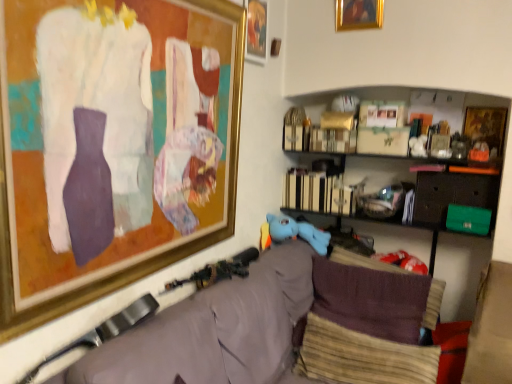
Question: Is wooden framed picture at upper right, the fourth picture frame viewed from the left, taller than matte brown cushion at lower right?

Choices:
 (A) yes
 (B) no

Answer: (B)

Question: Is wooden framed picture at upper right, the fourth picture frame viewed from the left, at the right side of matte brown cushion at lower right?

Choices:
 (A) no
 (B) yes

Answer: (B)

Question: Can you confirm if wooden framed picture at upper right, the fourth picture frame viewed from the left, is shorter than matte brown cushion at lower right?

Choices:
 (A) no
 (B) yes

Answer: (B)

Question: Is there a large distance between wooden framed picture at upper right, the first picture frame from the right, and matte brown cushion at lower right?

Choices:
 (A) no
 (B) yes

Answer: (A)

Question: Is wooden framed picture at upper right, the first picture frame from the right, to the left of matte brown cushion at lower right from the viewer's perspective?

Choices:
 (A) yes
 (B) no

Answer: (B)

Question: Does wooden framed picture at upper right, the first picture frame from the right, have a greater width compared to matte brown cushion at lower right?

Choices:
 (A) no
 (B) yes

Answer: (A)

Question: Is gold-framed painting at upper left, the fourth picture frame viewed from the right, facing towards blue plush toy at center?

Choices:
 (A) yes
 (B) no

Answer: (B)

Question: Does gold-framed painting at upper left, which is the first picture frame in left-to-right order, lie in front of blue plush toy at center?

Choices:
 (A) yes
 (B) no

Answer: (A)

Question: From a real-world perspective, is gold-framed painting at upper left, the fourth picture frame viewed from the right, below blue plush toy at center?

Choices:
 (A) no
 (B) yes

Answer: (A)

Question: Does gold-framed painting at upper left, which is the first picture frame in left-to-right order, come behind blue plush toy at center?

Choices:
 (A) yes
 (B) no

Answer: (B)

Question: Does gold-framed painting at upper left, which is the first picture frame in left-to-right order, have a lesser height compared to blue plush toy at center?

Choices:
 (A) no
 (B) yes

Answer: (A)

Question: Is gold-framed picture at upper center, which ranks as the third picture frame in right-to-left order, in front of gold-framed painting at upper center, the second picture frame viewed from the right?

Choices:
 (A) no
 (B) yes

Answer: (B)